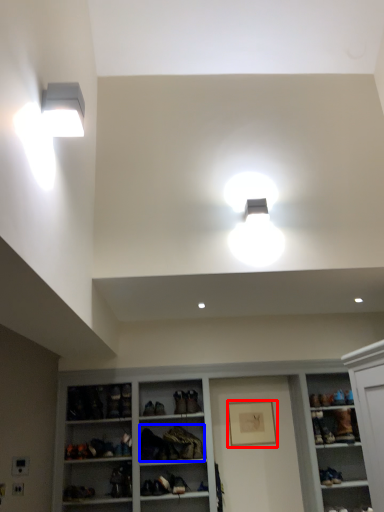
Question: Which object is further to the camera taking this photo, picture frame (highlighted by a red box) or clothing (highlighted by a blue box)?

Choices:
 (A) picture frame
 (B) clothing

Answer: (A)